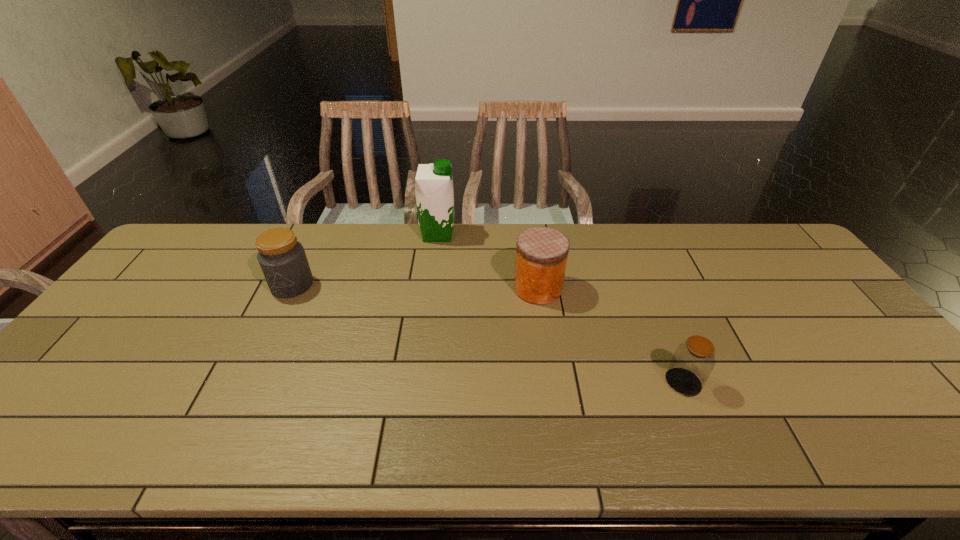
At what (x,y) coordinates should I click in order to perform the action: click on vacant space in between the shortest object and the leftmost object. Please return your answer as a coordinate pair (x, y). This screenshot has width=960, height=540. Looking at the image, I should click on (488, 334).

I want to click on vacant space that's between the nearest object and the farthest object, so click(561, 308).

The image size is (960, 540). I want to click on free spot between the leftmost object and the nearest jar, so (488, 334).

Find the location of a particular element. The width and height of the screenshot is (960, 540). vacant point located between the shortest jar and the tallest object is located at coordinates (561, 308).

I want to click on empty space that is in between the leftmost object and the third object from left to right, so click(415, 287).

Where is `object that is the third closest to the shortest jar`? This screenshot has height=540, width=960. object that is the third closest to the shortest jar is located at coordinates [x=283, y=261].

Identify which object is located as the third nearest to the leftmost jar. Please provide its 2D coordinates. Your answer should be formatted as a tuple, i.e. [(x, y)], where the tuple contains the x and y coordinates of a point satisfying the conditions above.

[(693, 361)]

Select which jar appears as the second closest to the second object from right to left. Please provide its 2D coordinates. Your answer should be formatted as a tuple, i.e. [(x, y)], where the tuple contains the x and y coordinates of a point satisfying the conditions above.

[(283, 261)]

At what (x,y) coordinates should I click in order to perform the action: click on jar that stands as the closest to the nearest jar. Please return your answer as a coordinate pair (x, y). The height and width of the screenshot is (540, 960). Looking at the image, I should click on (541, 256).

Where is `vacant area in the image that satisfies the following two spatial constraints: 1. on the front-facing side of the farthest object; 2. on the surface of the leftmost jar near the warning symbol`? The height and width of the screenshot is (540, 960). vacant area in the image that satisfies the following two spatial constraints: 1. on the front-facing side of the farthest object; 2. on the surface of the leftmost jar near the warning symbol is located at coordinates (432, 285).